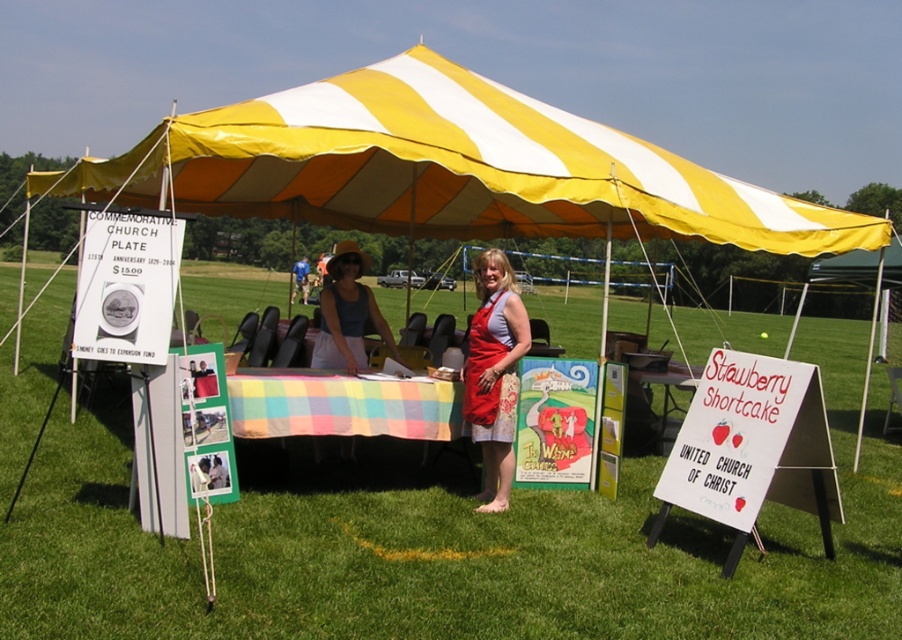
Which of these two, yellow/white striped canopy at upper center or denim jacket at center, stands shorter?

yellow/white striped canopy at upper center is shorter.

Who is more distant from viewer, [219,157] or [306,262]?

The point [306,262] is more distant.

Where is `yellow/white striped canopy at upper center`? The width and height of the screenshot is (902, 640). yellow/white striped canopy at upper center is located at coordinates (447, 168).

Who is more forward, (354, 259) or (309, 268)?

Positioned in front is point (354, 259).

Between matte gray tank top at center and denim jacket at center, which one is positioned lower?

matte gray tank top at center

Between point (338, 323) and point (297, 291), which one is positioned in front?

Positioned in front is point (338, 323).

The width and height of the screenshot is (902, 640). In order to click on matte gray tank top at center in this screenshot , I will do `click(347, 314)`.

Based on the photo, who is lower down, red apron at center or denim jacket at center?

red apron at center is lower down.

The height and width of the screenshot is (640, 902). I want to click on red apron at center, so click(494, 372).

The width and height of the screenshot is (902, 640). What are the coordinates of `red apron at center` in the screenshot? It's located at (494, 372).